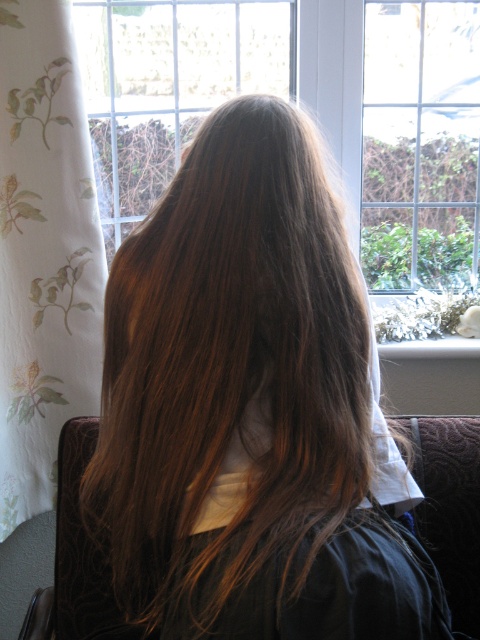
You are standing in the room and want to reach a specific point marked at coordinates point (57, 115). If your reach is 5 feet, can you touch it without moving your feet?

The distance of point (57, 115) from camera is 4.95 feet, so yes, you can touch it since your reach is 5 feet which is longer than the distance.